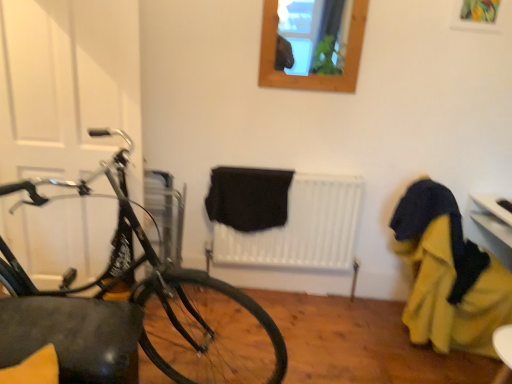
This screenshot has height=384, width=512. I want to click on vacant area situated below black matte radiator at center (from a real-world perspective), so click(277, 285).